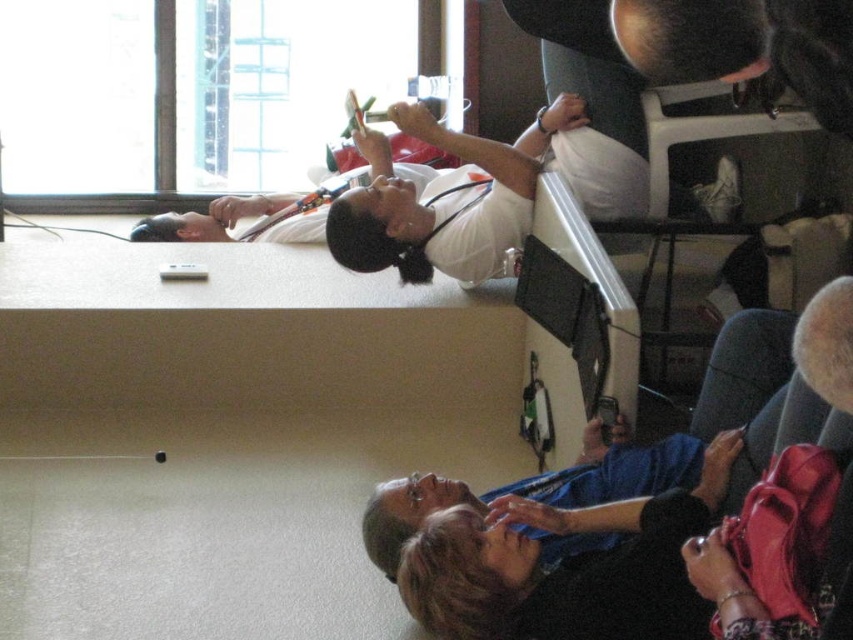
Does white matte stethoscope at upper center have a lesser height compared to blue fabric shirt at lower right?

Incorrect, white matte stethoscope at upper center's height does not fall short of blue fabric shirt at lower right's.

Who is shorter, white matte stethoscope at upper center or blue fabric shirt at lower right?

Standing shorter between the two is blue fabric shirt at lower right.

The height and width of the screenshot is (640, 853). Describe the element at coordinates (444, 198) in the screenshot. I see `white matte stethoscope at upper center` at that location.

Image resolution: width=853 pixels, height=640 pixels. What are the coordinates of `white matte stethoscope at upper center` in the screenshot? It's located at (444, 198).